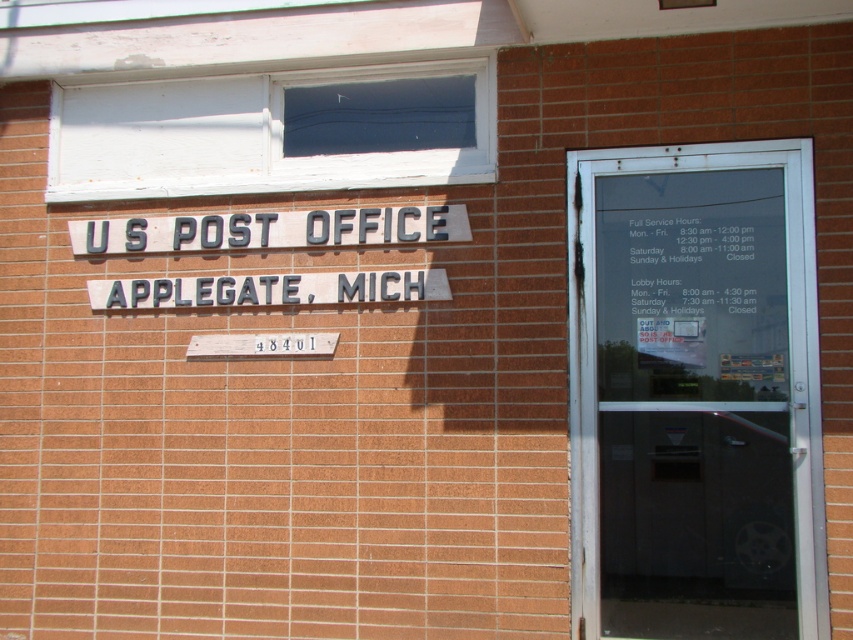
You are a postal worker who needs to deliver a package to the Applegate Post Office. You arrive and see the white painted wood window at upper center and the gray metallic sign at upper center. Which one is closer to you?

The white painted wood window at upper center and gray metallic sign at upper center are 13.35 inches apart, but the description does not specify which one is closer. Therefore, it is impossible to determine which one is closer based on the provided information.

You are an architect reviewing the exterior design of the U.S. Post Office in Applegate, Michigan. You need to determine which object occupies more space on the facade between the white painted wood window at upper center and the gray metallic sign at upper center. Which one is larger?

The white painted wood window at upper center is larger in size than the gray metallic sign at upper center according to the description.

You are standing in front of the U.S. Post Office in Applegate, Michigan. You need to enter the building. Which object should you approach first, the transparent glass door at center or the white painted wood window at upper center?

You should approach the transparent glass door at center first because it is the entrance, and the white painted wood window at upper center is above it and cannot be entered.